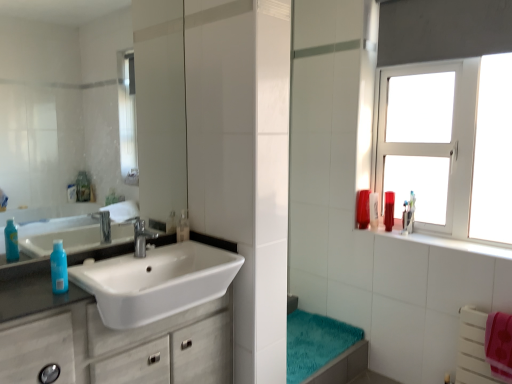
I want to click on free point behind silver metallic faucet at center, so click(x=164, y=246).